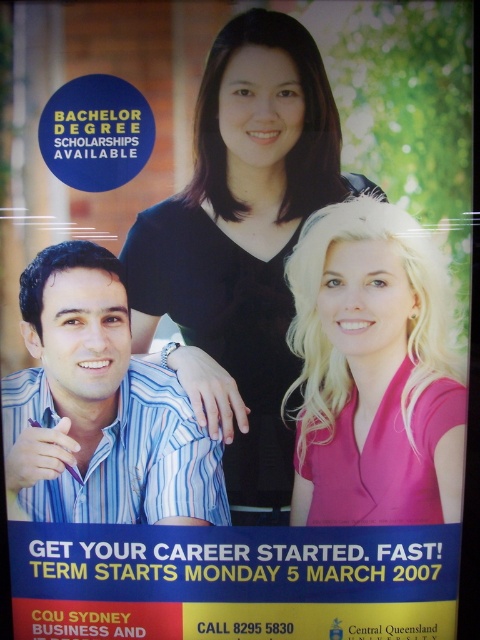
Is pink satin blouse at right wider than blue striped shirt at lower left?

No.

Identify the location of pink satin blouse at right. (372, 369).

Does black matte shirt at center have a smaller size compared to pink satin blouse at right?

No, black matte shirt at center is not smaller than pink satin blouse at right.

Between black matte shirt at center and pink satin blouse at right, which one appears on the left side from the viewer's perspective?

From the viewer's perspective, black matte shirt at center appears more on the left side.

Between point (207, 314) and point (398, 260), which one is positioned in front?

Point (398, 260) is in front.

Identify the location of black matte shirt at center. (241, 246).

Does black matte shirt at center have a smaller size compared to blue striped shirt at lower left?

Incorrect, black matte shirt at center is not smaller in size than blue striped shirt at lower left.

Does black matte shirt at center appear on the right side of blue striped shirt at lower left?

Indeed, black matte shirt at center is positioned on the right side of blue striped shirt at lower left.

Find the location of a particular element. black matte shirt at center is located at coordinates (241, 246).